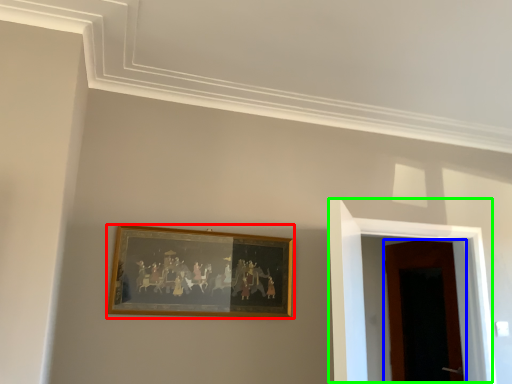
Question: Which object is the farthest from picture frame (highlighted by a red box)? Choose among these: door (highlighted by a blue box) or door (highlighted by a green box).

Choices:
 (A) door
 (B) door

Answer: (A)